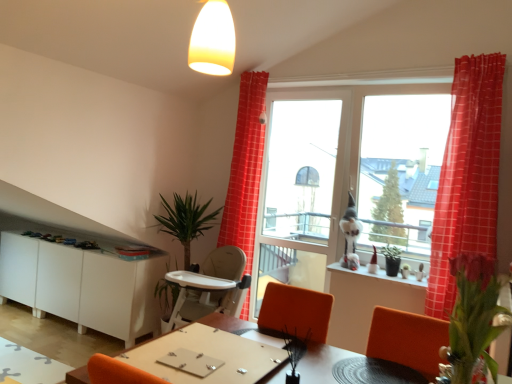
Question: Does point (404, 283) appear closer or farther from the camera than point (289, 344)?

Choices:
 (A) closer
 (B) farther

Answer: (B)

Question: Considering the relative positions of white glossy window sill at lower right and green matte plant at lower center, which is the 2th plant in front-to-back order, in the image provided, is white glossy window sill at lower right to the left or to the right of green matte plant at lower center, which is the 2th plant in front-to-back order,?

Choices:
 (A) left
 (B) right

Answer: (B)

Question: Which object is the closest to the pink matte flower at right, which appears as the first plant when viewed from the right?

Choices:
 (A) white matte cabinet at lower left
 (B) white glossy window sill at lower right
 (C) wooden table at center, which is the 1th table in front-to-back order
 (D) transparent glass screen door at center
 (E) green leafy plant at left

Answer: (C)

Question: Which object is positioned farthest from the wooden table at center, marked as the second table in a bottom-to-top arrangement?

Choices:
 (A) white matte cabinet at lower left
 (B) red checkered curtain at upper center, acting as the 2th curtain starting from the front
 (C) white glossy window sill at lower right
 (D) green matte plant at lower center, marked as the second plant in a right-to-left arrangement
 (E) green leafy plant at left

Answer: (A)